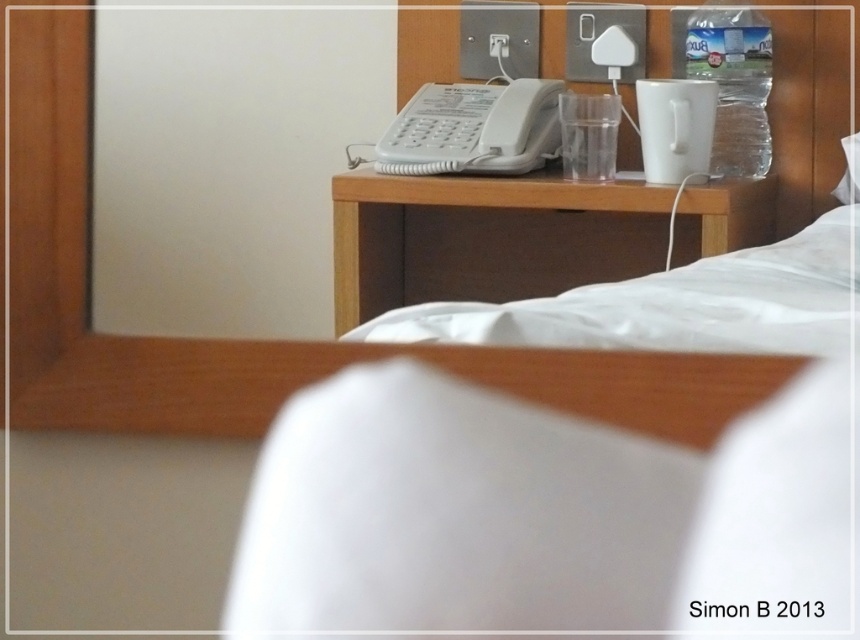
From the picture: You are a hotel guest who wants to place a small nightlight between the matte wooden mirror at upper center and the transparent plastic bottle at center on the bedside table. The nightlight requires 5 inches of space to fit. Can you fit it between them?

The matte wooden mirror at upper center and transparent plastic bottle at center are 6.32 inches apart from each other, so yes, the nightlight requiring 5 inches of space can fit between them since the available space is larger than the required space.

You are a guest in the hotel room and want to reach the transparent plastic bottle at center on the bedside table. There is a white plastic phone at center blocking your access. Can you move the phone to get to the bottle?

The white plastic phone at center is in front of the transparent plastic bottle at center, so you can move the phone to access the bottle.